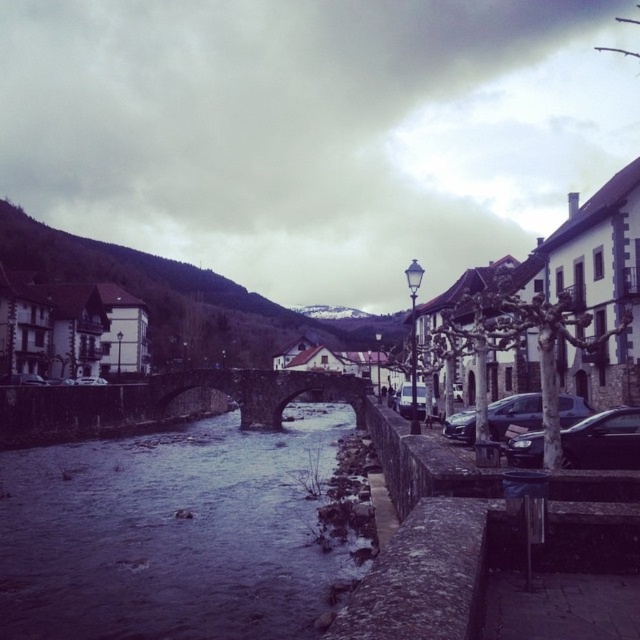
Is dark gray metallic car at center right to the left of satin silver sedan at center from the viewer's perspective?

Incorrect, dark gray metallic car at center right is not on the left side of satin silver sedan at center.

Does dark gray metallic car at center right lie behind satin silver sedan at center?

No.

What are the coordinates of `dark gray metallic car at center right` in the screenshot? It's located at (513, 413).

Is dark stone bridge at center to the left of dark gray metallic car at center right from the viewer's perspective?

Indeed, dark stone bridge at center is positioned on the left side of dark gray metallic car at center right.

Does dark stone bridge at center appear over dark gray metallic car at center right?

Actually, dark stone bridge at center is below dark gray metallic car at center right.

The height and width of the screenshot is (640, 640). Describe the element at coordinates (260, 390) in the screenshot. I see `dark stone bridge at center` at that location.

Identify the location of dark stone bridge at center. The width and height of the screenshot is (640, 640). (260, 390).

Is matte white building at left below shiny black sedan at center right?

No, matte white building at left is not below shiny black sedan at center right.

Describe the element at coordinates (70, 328) in the screenshot. I see `matte white building at left` at that location.

You are a GUI agent. You are given a task and a screenshot of the screen. Output one action in this format:
    pyautogui.click(x=<x>, y=<y>)
    Task: Click on the matte white building at left
    Image resolution: width=640 pixels, height=640 pixels.
    Given the screenshot: What is the action you would take?
    pyautogui.click(x=70, y=328)